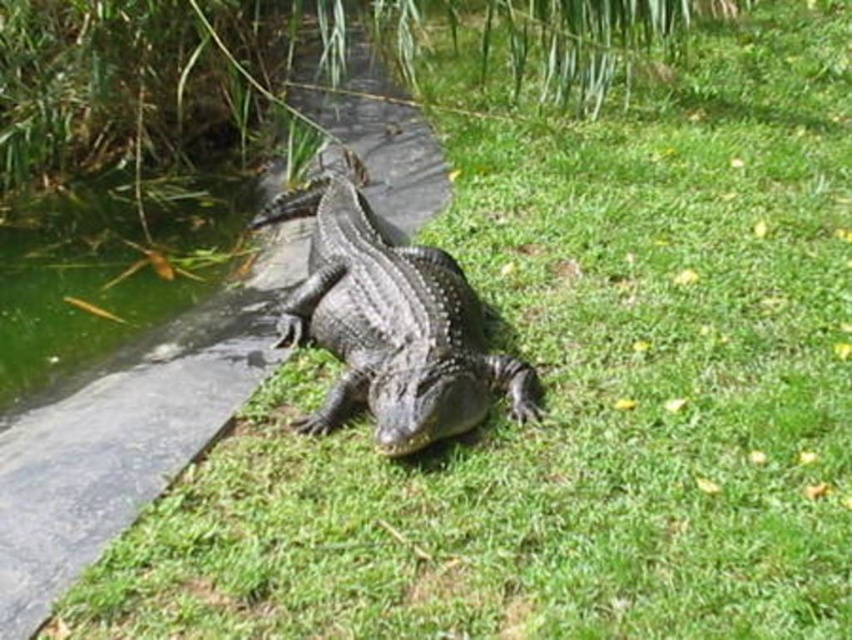
Is shiny dark green crocodile at center shorter than green algae water at lower left?

Correct, shiny dark green crocodile at center is not as tall as green algae water at lower left.

Between point (492, 397) and point (82, 317), which one is positioned in front?

Point (492, 397) is more forward.

I want to click on shiny dark green crocodile at center, so click(389, 320).